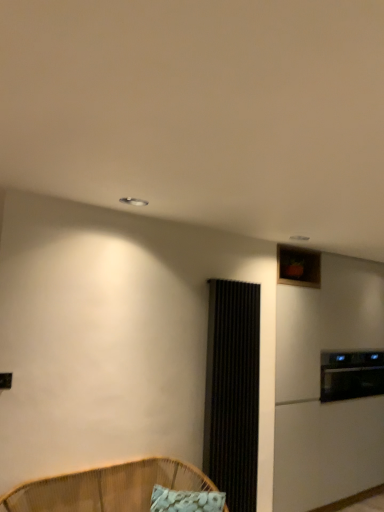
Question: Is black textured screen door at center-right far away from woven bamboo chair at lower left?

Choices:
 (A) yes
 (B) no

Answer: (B)

Question: Is black textured screen door at center-right to the left of woven bamboo chair at lower left from the viewer's perspective?

Choices:
 (A) yes
 (B) no

Answer: (B)

Question: Is black textured screen door at center-right taller than woven bamboo chair at lower left?

Choices:
 (A) no
 (B) yes

Answer: (B)

Question: From a real-world perspective, is black textured screen door at center-right positioned over woven bamboo chair at lower left based on gravity?

Choices:
 (A) no
 (B) yes

Answer: (B)

Question: Is woven bamboo chair at lower left at the back of black textured screen door at center-right?

Choices:
 (A) no
 (B) yes

Answer: (A)

Question: Considering their positions, is black textured screen door at center-right located in front of or behind woven bamboo chair at lower left?

Choices:
 (A) front
 (B) behind

Answer: (B)

Question: From the image's perspective, relative to woven bamboo chair at lower left, is black textured screen door at center-right above or below?

Choices:
 (A) below
 (B) above

Answer: (B)

Question: Looking at the image, does black textured screen door at center-right seem bigger or smaller compared to woven bamboo chair at lower left?

Choices:
 (A) big
 (B) small

Answer: (B)

Question: Is point (256, 479) closer or farther from the camera than point (172, 466)?

Choices:
 (A) closer
 (B) farther

Answer: (B)

Question: From a real-world perspective, is black textured screen door at center-right physically located above or below black glass oven at right?

Choices:
 (A) below
 (B) above

Answer: (A)

Question: Do you think black textured screen door at center-right is within black glass oven at right, or outside of it?

Choices:
 (A) inside
 (B) outside

Answer: (B)

Question: Is black textured screen door at center-right to the left or to the right of black glass oven at right in the image?

Choices:
 (A) left
 (B) right

Answer: (A)

Question: Is black textured screen door at center-right wider or thinner than black glass oven at right?

Choices:
 (A) thin
 (B) wide

Answer: (A)

Question: From a real-world perspective, is black glass oven at right physically located above or below white fabric pillow at lower center?

Choices:
 (A) above
 (B) below

Answer: (A)

Question: Is point (354, 394) closer or farther from the camera than point (172, 492)?

Choices:
 (A) farther
 (B) closer

Answer: (A)